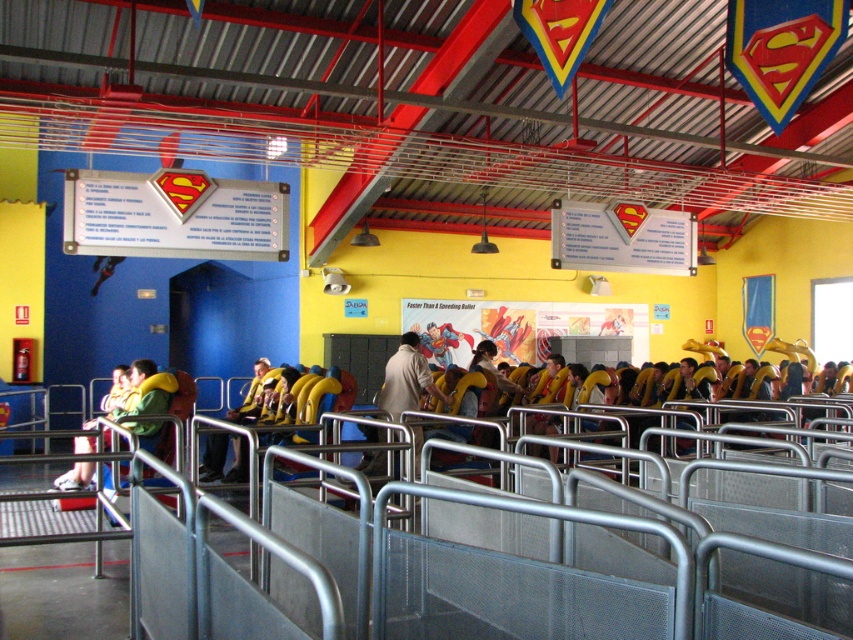
You are standing in the Superman themed area and want to locate the metallic silver rail at center. According to the coordinates given, where would you find it?

The metallic silver rail at center is located at the coordinates point [521,579].

You are a costume designer working on a Superman exhibit and need to choose between the green fabric jacket at center and the light brown leather jacket at center. Based on their sizes, which jacket would be more suitable for a life size Superman statue?

The green fabric jacket at center is larger in size than the light brown leather jacket at center, so it would be more suitable for a life size Superman statue as it can better fit the statue.